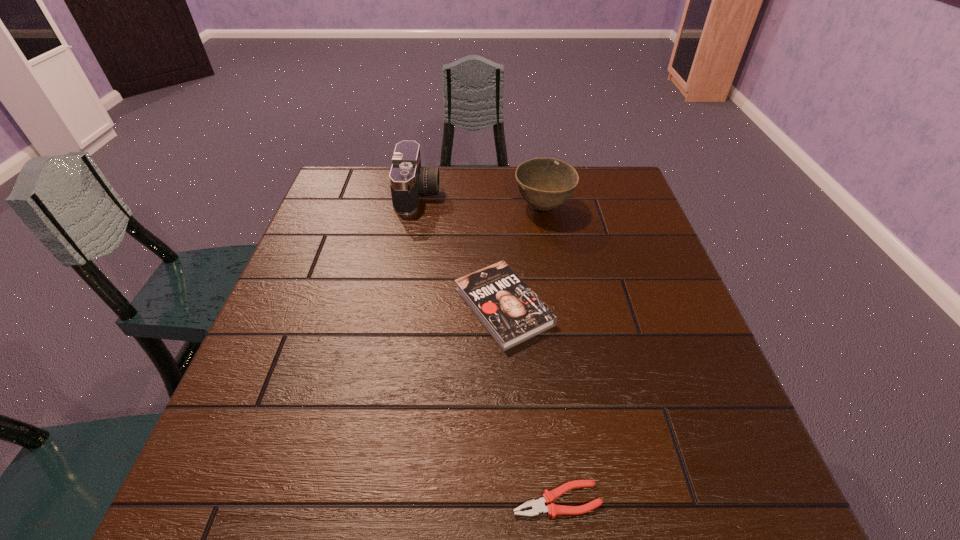
The image size is (960, 540). Identify the location of the leftmost object. (408, 180).

Where is `bowl`? Image resolution: width=960 pixels, height=540 pixels. bowl is located at coordinates (545, 183).

Identify the location of book. (511, 312).

I want to click on the third tallest object, so click(511, 312).

I want to click on the shortest object, so click(538, 506).

I want to click on pliers, so click(x=538, y=506).

I want to click on vacant space situated on the front-facing side of the leftmost object, so click(527, 194).

Identify the location of vacant area located 0.190m on the front of the bowl. The image size is (960, 540). (555, 274).

This screenshot has height=540, width=960. Identify the location of free spot located 0.270m on the front of the book. (513, 488).

Find the location of `vacant space situated on the left of the shortest object`. vacant space situated on the left of the shortest object is located at coordinates (304, 500).